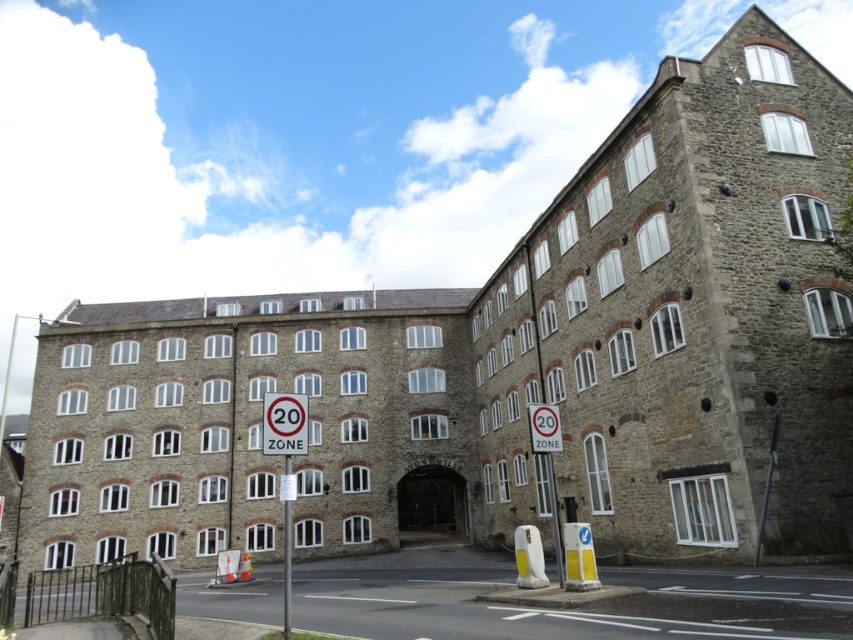
Question: Among these objects, which one is farthest from the camera?

Choices:
 (A) white plastic pole at lower center
 (B) red plastic sign at center

Answer: (B)

Question: Which point is farther from the camera taking this photo?

Choices:
 (A) (293, 410)
 (B) (555, 444)
 (C) (286, 636)

Answer: (B)

Question: Is red plastic sign at center to the right of metallic silver sign at center from the viewer's perspective?

Choices:
 (A) no
 (B) yes

Answer: (A)

Question: Is metallic silver sign at center positioned before white plastic pole at lower center?

Choices:
 (A) yes
 (B) no

Answer: (B)

Question: Where is red plastic sign at center located in relation to metallic silver sign at center in the image?

Choices:
 (A) below
 (B) above

Answer: (A)

Question: Which of these objects is positioned closest to the red plastic sign at center?

Choices:
 (A) metallic silver sign at center
 (B) white plastic pole at lower center

Answer: (B)